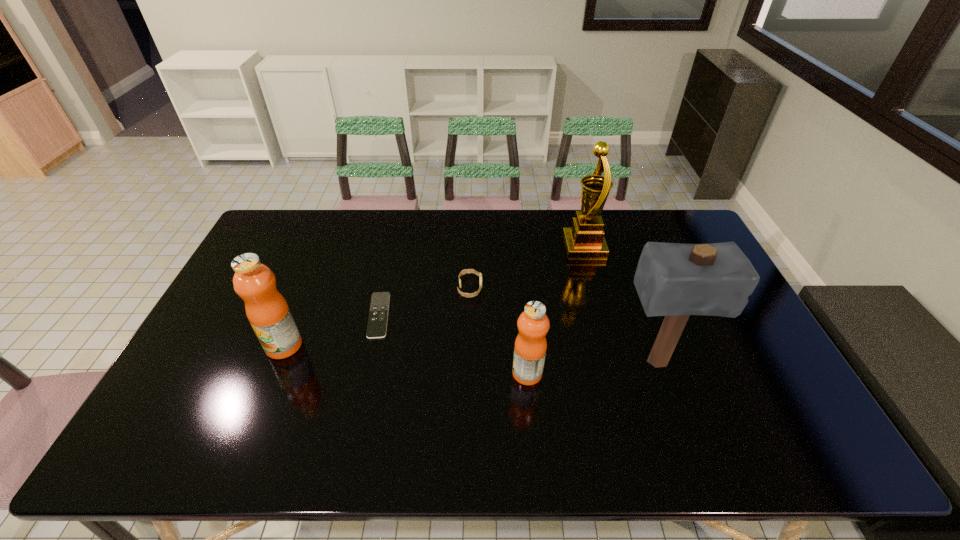
Where is `free area in between the nearer fruit juice and the farther fruit juice`? The width and height of the screenshot is (960, 540). free area in between the nearer fruit juice and the farther fruit juice is located at coordinates (406, 360).

Find the location of a particular element. unoccupied area between the fourth object from right to left and the shortest object is located at coordinates (424, 302).

At what (x,y) coordinates should I click in order to perform the action: click on unoccupied position between the remote control and the left fruit juice. Please return your answer as a coordinate pair (x, y). Looking at the image, I should click on click(x=331, y=330).

Locate an element on the screen. free space between the fifth tallest object and the fourth tallest object is located at coordinates (498, 330).

Identify the location of unoccupied area between the watch and the fourth tallest object. (498, 330).

Where is `free spot between the third object from right to left and the award`? This screenshot has width=960, height=540. free spot between the third object from right to left and the award is located at coordinates [x=556, y=310].

Identify which object is the nearest to the watch. Please provide its 2D coordinates. Your answer should be formatted as a tuple, i.e. [(x, y)], where the tuple contains the x and y coordinates of a point satisfying the conditions above.

[(378, 315)]

Identify which object is located as the fourth nearest to the shortest object. Please provide its 2D coordinates. Your answer should be formatted as a tuple, i.e. [(x, y)], where the tuple contains the x and y coordinates of a point satisfying the conditions above.

[(585, 239)]

The width and height of the screenshot is (960, 540). In order to click on vacant point that satisfies the following two spatial constraints: 1. on the front-facing side of the award; 2. on the back side of the mallet in this screenshot , I will do `click(615, 362)`.

Identify the location of vacant space that satisfies the following two spatial constraints: 1. on the back side of the nearer fruit juice; 2. on the right side of the mallet. The width and height of the screenshot is (960, 540). (526, 362).